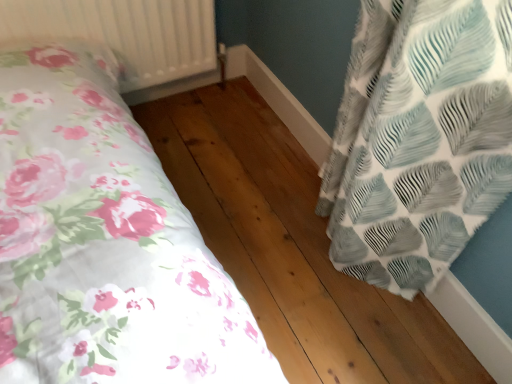
Question: From a real-world perspective, relative to natural wood flooring at center, is white textured radiator at upper left vertically above or below?

Choices:
 (A) below
 (B) above

Answer: (B)

Question: From the image's perspective, is white textured radiator at upper left located above or below natural wood flooring at center?

Choices:
 (A) below
 (B) above

Answer: (B)

Question: Is white textured radiator at upper left bigger or smaller than natural wood flooring at center?

Choices:
 (A) big
 (B) small

Answer: (A)

Question: Looking at the image, does natural wood flooring at center seem bigger or smaller compared to white textured radiator at upper left?

Choices:
 (A) small
 (B) big

Answer: (A)

Question: Considering the positions of natural wood flooring at center and white textured radiator at upper left in the image, is natural wood flooring at center wider or thinner than white textured radiator at upper left?

Choices:
 (A) wide
 (B) thin

Answer: (B)

Question: Does point (336, 289) appear closer or farther from the camera than point (96, 36)?

Choices:
 (A) closer
 (B) farther

Answer: (A)

Question: In terms of height, does natural wood flooring at center look taller or shorter compared to white textured radiator at upper left?

Choices:
 (A) tall
 (B) short

Answer: (B)